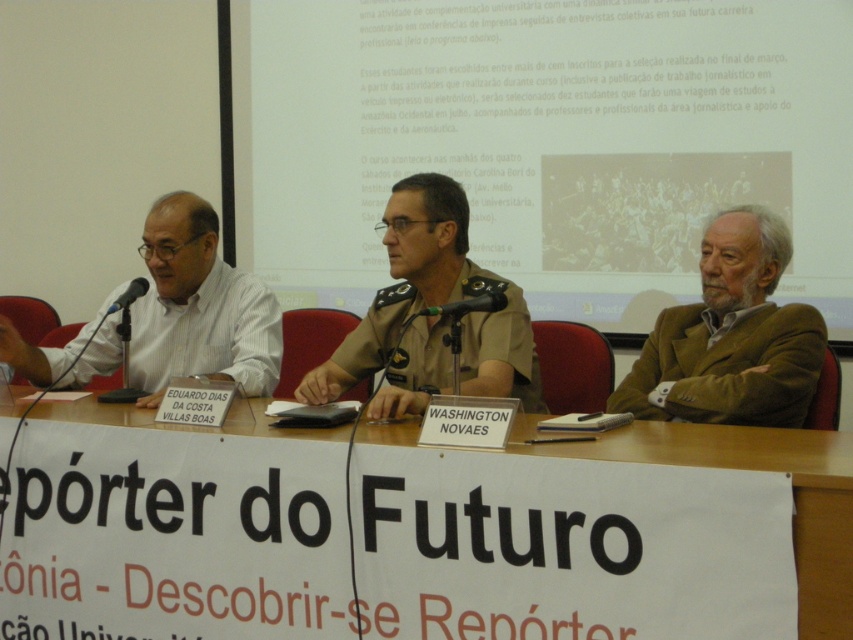
Does white paperboard at center appear on the left side of matte white shirt at left?

No, white paperboard at center is not to the left of matte white shirt at left.

Is white paperboard at center below matte white shirt at left?

Yes.

Locate an element on the screen. white paperboard at center is located at coordinates (604, 536).

This screenshot has height=640, width=853. What do you see at coordinates (432, 317) in the screenshot?
I see `khaki uniform at center` at bounding box center [432, 317].

Between khaki uniform at center and matte black microphone at left, which one appears on the left side from the viewer's perspective?

matte black microphone at left

What are the coordinates of `khaki uniform at center` in the screenshot? It's located at click(432, 317).

At what (x,y) coordinates should I click in order to perform the action: click on khaki uniform at center. Please return your answer as a coordinate pair (x, y). This screenshot has width=853, height=640. Looking at the image, I should click on (432, 317).

Between point (421, 189) and point (462, 305), which one is positioned in front?

Point (462, 305) is in front.

This screenshot has height=640, width=853. Identify the location of khaki uniform at center. (432, 317).

Locate an element on the screen. khaki uniform at center is located at coordinates (432, 317).